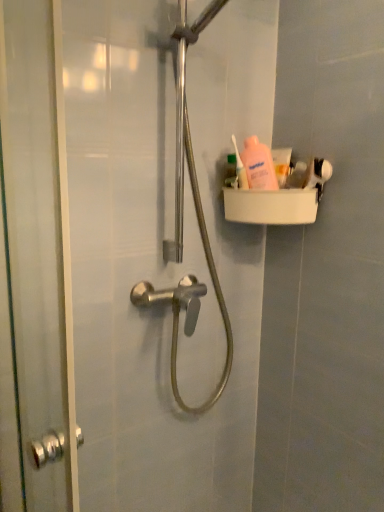
Question: Is point (291, 150) closer or farther from the camera than point (288, 181)?

Choices:
 (A) closer
 (B) farther

Answer: (B)

Question: From the image's perspective, is white matte toothpaste at upper right above or below pink matte lotion at upper right, which is the 2th toiletry in left-to-right order?

Choices:
 (A) below
 (B) above

Answer: (B)

Question: Which object is positioned closest to the pink plastic bottle at upper right, which is counted as the 1th toiletry, starting from the left?

Choices:
 (A) white matte toothpaste at upper right
 (B) pink matte lotion at upper right, acting as the 1th toiletry starting from the right
 (C) transparent glass screen door at left

Answer: (A)

Question: Which of these objects is positioned farthest from the pink matte lotion at upper right, which is the 2th toiletry in left-to-right order?

Choices:
 (A) white matte toothpaste at upper right
 (B) transparent glass screen door at left
 (C) pink plastic bottle at upper right, which is counted as the 1th toiletry, starting from the left

Answer: (B)